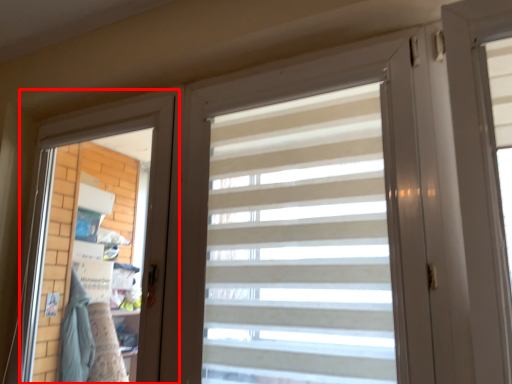
Question: In this image, where is screen door (annotated by the red box) located relative to curtain?

Choices:
 (A) left
 (B) right

Answer: (A)